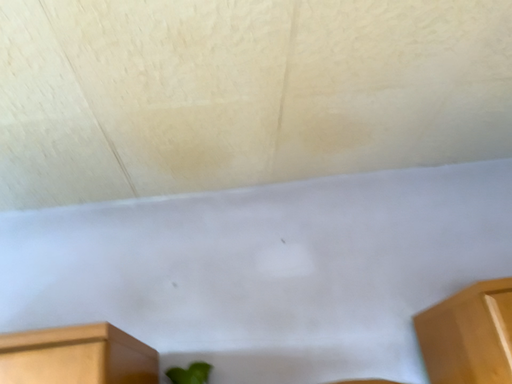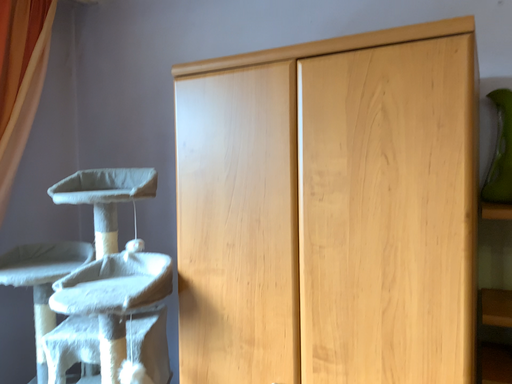
Question: Which way did the camera rotate in the video?

Choices:
 (A) rotated upward
 (B) rotated downward

Answer: (B)